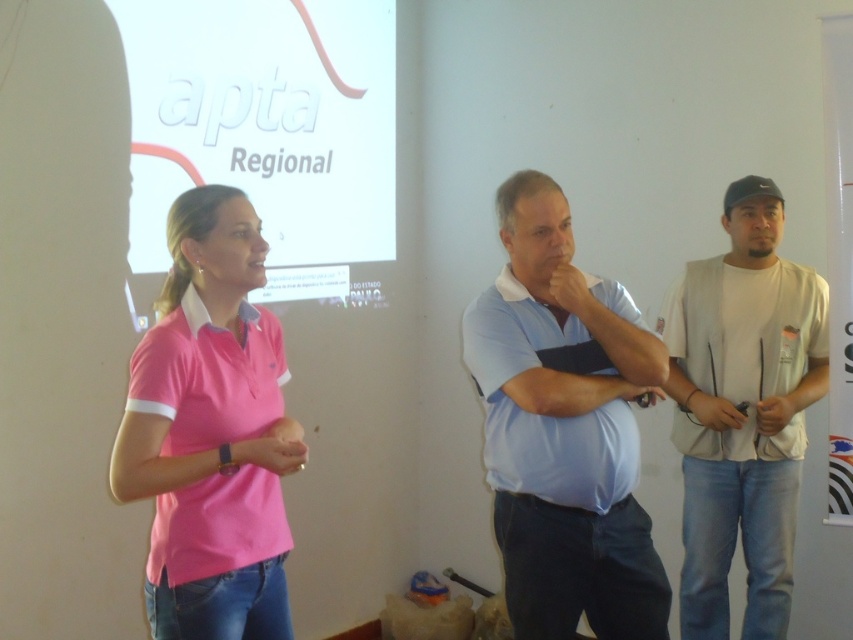
You are organizing a charity event and need to determine which of the two items, the white cotton shirt at right or the light blue fabric at center, can better accommodate a logo patch that requires a minimum of 20 square inches of space. Based on their sizes, which one would you choose?

The white cotton shirt at right is larger in size than the light blue fabric at center, so the white cotton shirt at right can better accommodate the logo patch requiring 20 square inches of space.

You are standing in the conference room and need to locate the pink cotton shirt at center. According to the spatial coordinates provided, what are its exact coordinates?

The pink cotton shirt at center is located at coordinates point (212, 433).